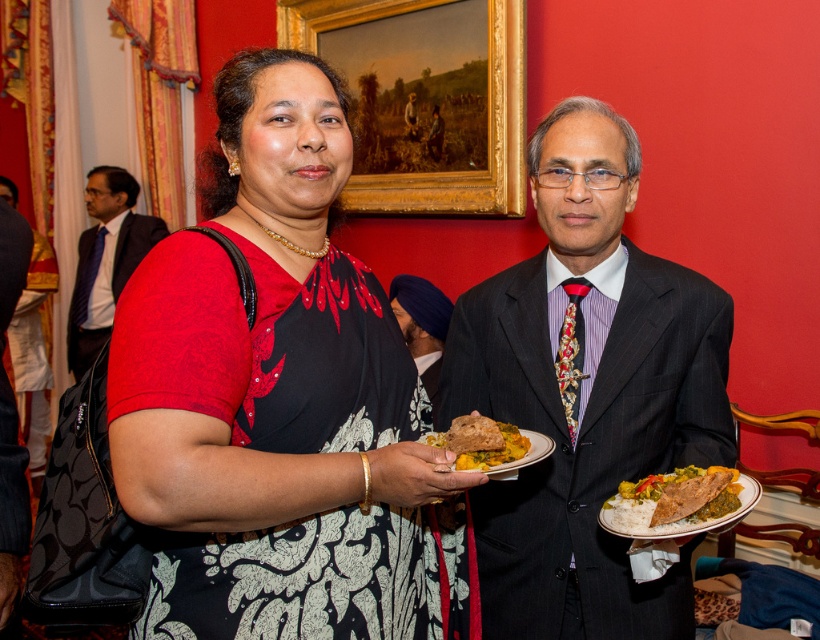
Between blue turban at center and golden brown bread at center, which one appears on the right side from the viewer's perspective?

From the viewer's perspective, golden brown bread at center appears more on the right side.

Is point (417, 307) less distant than point (451, 444)?

No, (417, 307) is further to viewer.

At what (x,y) coordinates should I click in order to perform the action: click on blue turban at center. Please return your answer as a coordinate pair (x, y). This screenshot has height=640, width=820. Looking at the image, I should click on pos(421,324).

Between goldwooden frame at upper center and blue turban at center, which one is positioned higher?

goldwooden frame at upper center

Can you confirm if goldwooden frame at upper center is bigger than blue turban at center?

Correct, goldwooden frame at upper center is larger in size than blue turban at center.

Based on the photo, measure the distance between goldwooden frame at upper center and camera.

goldwooden frame at upper center and camera are 8.17 feet apart.

Locate an element on the screen. The width and height of the screenshot is (820, 640). goldwooden frame at upper center is located at coordinates (486, 141).

Does point (249, 416) come farther from viewer compared to point (500, 582)?

No.

Between point (188, 464) and point (513, 337), which one is positioned behind?

The point (513, 337) is behind.

This screenshot has height=640, width=820. I want to click on matte black dress at center, so click(x=281, y=401).

Locate an element on the screen. The width and height of the screenshot is (820, 640). matte black dress at center is located at coordinates (281, 401).